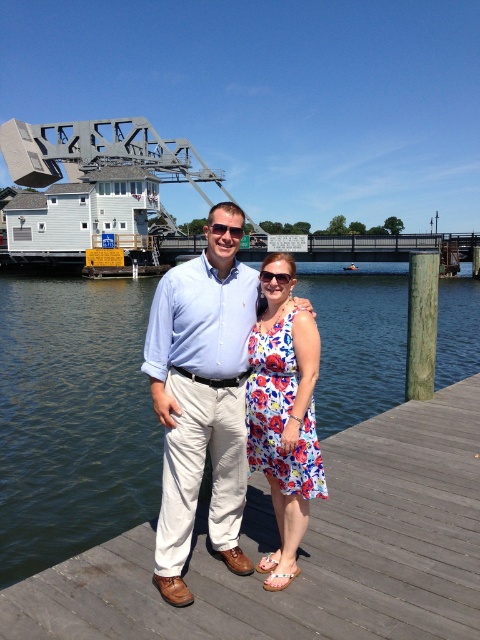
Can you confirm if floral fabric dress at center is positioned to the right of shiny plastic sunglasses at center?

Indeed, floral fabric dress at center is positioned on the right side of shiny plastic sunglasses at center.

This screenshot has height=640, width=480. I want to click on floral fabric dress at center, so click(284, 417).

Which is behind, point (189, 337) or point (276, 481)?

Point (276, 481)

Is light blue cotton shirt at center wider than floral fabric dress at center?

In fact, light blue cotton shirt at center might be narrower than floral fabric dress at center.

Between point (164, 570) and point (249, 433), which one is positioned behind?

Point (249, 433)

The width and height of the screenshot is (480, 640). I want to click on light blue cotton shirt at center, so click(202, 397).

Can you confirm if floral fabric dress at center is wider than clear plastic sunglasses at center?

Correct, the width of floral fabric dress at center exceeds that of clear plastic sunglasses at center.

Which of these two, floral fabric dress at center or clear plastic sunglasses at center, stands shorter?

clear plastic sunglasses at center is shorter.

The height and width of the screenshot is (640, 480). What do you see at coordinates (284, 417) in the screenshot?
I see `floral fabric dress at center` at bounding box center [284, 417].

Identify the location of floral fabric dress at center. (284, 417).